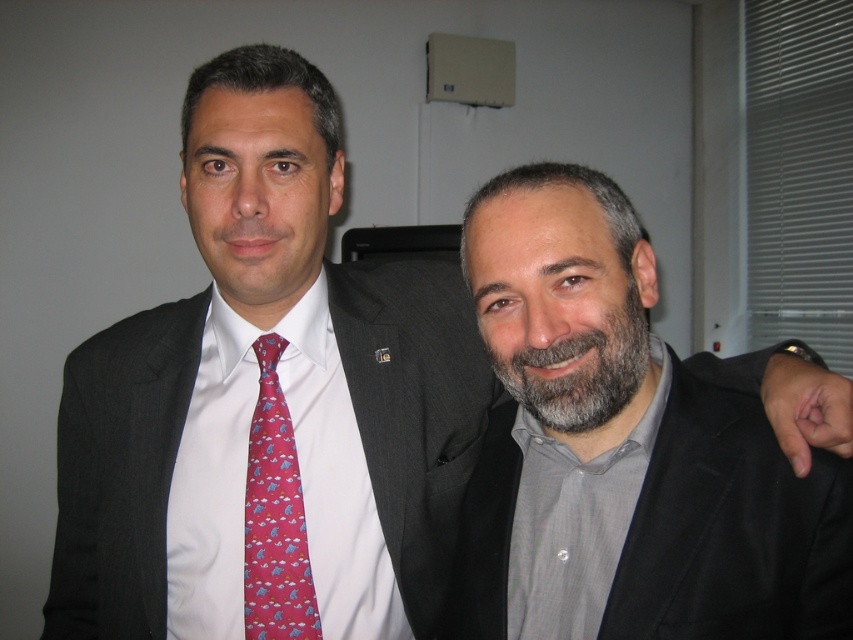
You are a photographer setting up for a group photo. You need to ensure that the gray matte suit at right and the grayhairbeard at center are both visible in the frame. Given that the camera has a fixed focal length, which object should you position closer to the camera to maintain clarity and avoid blurriness?

The gray matte suit at right should be positioned closer to the camera because it is wider than the grayhairbeard at center, ensuring both fit clearly within the frame without blurriness.

You are an event organizer who needs to arrange seating for a photo shoot. You have two people in the scene. The first person is wearing a pink silk tie at left, and the second is wearing a gray matte suit at right. Based on their positions in the image, which person should you seat on the left side of the photo to maintain their original spatial relationship?

The pink silk tie at left should be seated on the left side of the photo, and the gray matte suit at right should be seated on the right side to maintain their original spatial relationship as described.

You are standing in an office and see two points marked in the image. The first point is at coordinates point (788, 516) and the second is at point (523, 388). Which point is closer to you?

Point (788, 516) is closer to the viewer than point (523, 388).